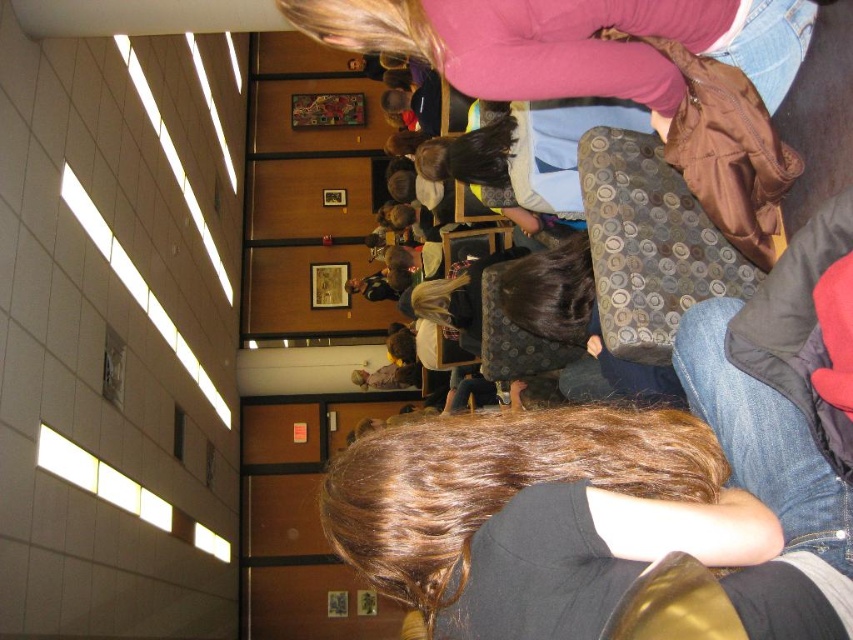
Can you confirm if pink fleece sweater at upper center is thinner than matte gray backpack at center?

No.

Identify the location of pink fleece sweater at upper center. The height and width of the screenshot is (640, 853). (569, 42).